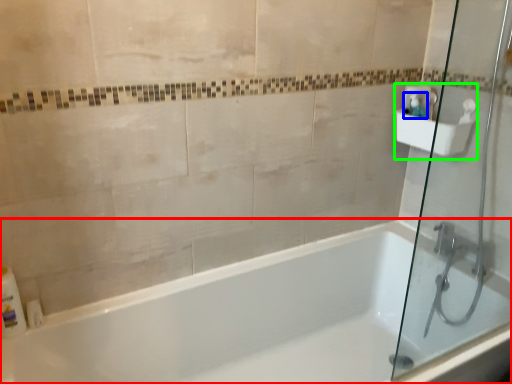
Question: Which object is the closest to the bathtub (highlighted by a red box)? Choose among these: soap dispenser (highlighted by a blue box) or sink (highlighted by a green box).

Choices:
 (A) soap dispenser
 (B) sink

Answer: (B)